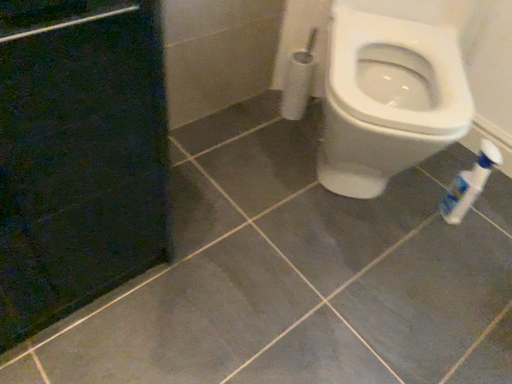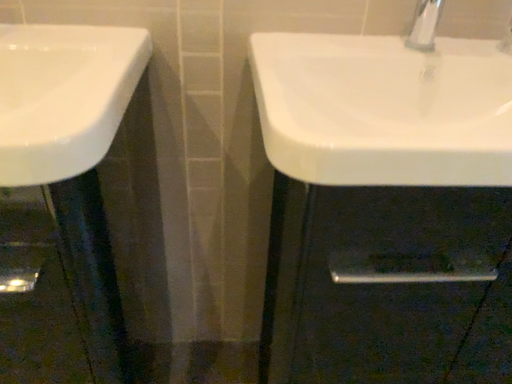
Question: Which way did the camera rotate in the video?

Choices:
 (A) rotated upward
 (B) rotated downward

Answer: (A)